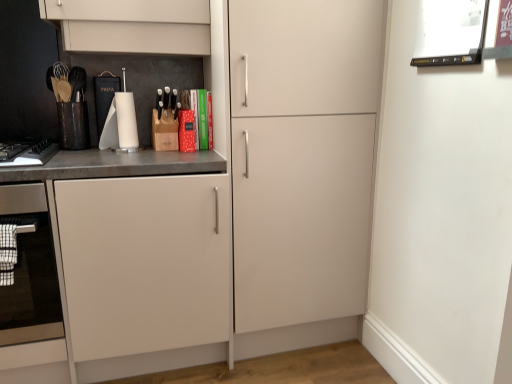
Locate an element on the screen. black matte keyboard at left is located at coordinates (33, 155).

What do you see at coordinates (56, 223) in the screenshot? I see `matte white cabinet at center` at bounding box center [56, 223].

How much space does white glossy picture frame at upper right, the 2th appliance when ordered from left to right, occupy vertically?

white glossy picture frame at upper right, the 2th appliance when ordered from left to right, is 9.01 inches tall.

Locate an element on the screen. Image resolution: width=512 pixels, height=384 pixels. stainless steel oven at left is located at coordinates (30, 270).

This screenshot has height=384, width=512. Find the location of `white glossy paper towel holder at center, the second appliance in the right-to-left sequence`. white glossy paper towel holder at center, the second appliance in the right-to-left sequence is located at coordinates (104, 96).

Considering the positions of objects matte white cabinet at center and stainless steel oven at left in the image provided, who is in front, matte white cabinet at center or stainless steel oven at left?

matte white cabinet at center is more forward.

Can we say matte white cabinet at center lies outside stainless steel oven at left?

That's correct, matte white cabinet at center is outside of stainless steel oven at left.

Is matte white cabinet at center to the right of stainless steel oven at left from the viewer's perspective?

Correct, you'll find matte white cabinet at center to the right of stainless steel oven at left.

Between black matte keyboard at left and matte white cabinet at center, which one has more height?

matte white cabinet at center.

In the scene shown: Is black matte keyboard at left oriented away from matte white cabinet at center?

No.

Does black matte keyboard at left appear on the right side of matte white cabinet at center?

Incorrect, black matte keyboard at left is not on the right side of matte white cabinet at center.

Relative to stainless steel oven at left, is white glossy paper towel holder at center, the first appliance from the back, in front or behind?

Clearly, white glossy paper towel holder at center, the first appliance from the back, is behind stainless steel oven at left.

Can we say white glossy paper towel holder at center, the second appliance in the right-to-left sequence, lies outside stainless steel oven at left?

Yes, white glossy paper towel holder at center, the second appliance in the right-to-left sequence, is outside of stainless steel oven at left.

Who is smaller, white glossy paper towel holder at center, the second appliance in the right-to-left sequence, or stainless steel oven at left?

Smaller between the two is white glossy paper towel holder at center, the second appliance in the right-to-left sequence.

From the picture: From the image's perspective, does white glossy paper towel holder at center, the second appliance in the right-to-left sequence, appear higher than stainless steel oven at left?

Yes, from the image's perspective, white glossy paper towel holder at center, the second appliance in the right-to-left sequence, is over stainless steel oven at left.

Considering the relative sizes of white glossy picture frame at upper right, placed as the first appliance when sorted from right to left, and black matte keyboard at left in the image provided, is white glossy picture frame at upper right, placed as the first appliance when sorted from right to left, bigger than black matte keyboard at left?

No.

Is white glossy picture frame at upper right, placed as the first appliance when sorted from right to left, completely or partially outside of black matte keyboard at left?

Yes, white glossy picture frame at upper right, placed as the first appliance when sorted from right to left, is not within black matte keyboard at left.

From a real-world perspective, is white glossy picture frame at upper right, positioned as the 2th appliance in back-to-front order, on top of black matte keyboard at left?

Correct, in the physical world, white glossy picture frame at upper right, positioned as the 2th appliance in back-to-front order, is higher than black matte keyboard at left.

Is white glossy picture frame at upper right, the 2th appliance when ordered from left to right, positioned with its back to black matte keyboard at left?

No, white glossy picture frame at upper right, the 2th appliance when ordered from left to right, is not facing the opposite direction of black matte keyboard at left.

Is stainless steel oven at left wider or thinner than white glossy picture frame at upper right, positioned as the 2th appliance in back-to-front order?

stainless steel oven at left is wider than white glossy picture frame at upper right, positioned as the 2th appliance in back-to-front order.

Is stainless steel oven at left smaller than white glossy picture frame at upper right, positioned as the 2th appliance in back-to-front order?

No.

From the image's perspective, is stainless steel oven at left on white glossy picture frame at upper right, which ranks as the 1th appliance in front-to-back order?

No, from the image's perspective, stainless steel oven at left is not above white glossy picture frame at upper right, which ranks as the 1th appliance in front-to-back order.

Considering the points (25, 261) and (438, 39), which point is in front, point (25, 261) or point (438, 39)?

Point (438, 39)

Is there a large distance between stainless steel oven at left and white glossy paper towel holder at center, which ranks as the first appliance in left-to-right order?

No, stainless steel oven at left is in close proximity to white glossy paper towel holder at center, which ranks as the first appliance in left-to-right order.

Is stainless steel oven at left positioned with its back to white glossy paper towel holder at center, the first appliance from the back?

No, stainless steel oven at left's orientation is not away from white glossy paper towel holder at center, the first appliance from the back.

Find the location of `oven on the left of white glossy paper towel holder at center, which appears as the second appliance when viewed from the front`. oven on the left of white glossy paper towel holder at center, which appears as the second appliance when viewed from the front is located at coordinates pos(30,270).

Can you confirm if stainless steel oven at left is wider than white glossy paper towel holder at center, which appears as the second appliance when viewed from the front?

Correct, the width of stainless steel oven at left exceeds that of white glossy paper towel holder at center, which appears as the second appliance when viewed from the front.

In the scene shown: Does matte white cabinet at center have a smaller size compared to black matte keyboard at left?

Actually, matte white cabinet at center might be larger than black matte keyboard at left.

Between matte white cabinet at center and black matte keyboard at left, which one appears on the right side from the viewer's perspective?

From the viewer's perspective, matte white cabinet at center appears more on the right side.

What's the angular difference between matte white cabinet at center and black matte keyboard at left's facing directions?

7.75e-05 degrees separate the facing orientations of matte white cabinet at center and black matte keyboard at left.

Is matte white cabinet at center beside black matte keyboard at left?

No.

Find the location of a particular element. cabinetry directly beneath the stainless steel oven at left (from a real-world perspective) is located at coordinates (56, 223).

Find the location of a particular element. home appliance above the matte white cabinet at center (from the image's perspective) is located at coordinates (33, 155).

In the scene shown: Based on their spatial positions, is stainless steel oven at left or matte white cabinet at center closer to black matte keyboard at left?

Among the two, matte white cabinet at center is located nearer to black matte keyboard at left.

Which object lies nearer to the anchor point matte white cabinet at center, black matte keyboard at left or white glossy paper towel holder at center, the first appliance from the back?

Among the two, black matte keyboard at left is located nearer to matte white cabinet at center.

Estimate the real-world distances between objects in this image. Which object is further from white glossy paper towel holder at center, which ranks as the first appliance in left-to-right order, black matte keyboard at left or stainless steel oven at left?

stainless steel oven at left is further to white glossy paper towel holder at center, which ranks as the first appliance in left-to-right order.

Which object lies nearer to the anchor point stainless steel oven at left, black matte keyboard at left or matte white cabinet at center?

Among the two, matte white cabinet at center is located nearer to stainless steel oven at left.

Based on their spatial positions, is matte white cabinet at center or stainless steel oven at left further from black matte keyboard at left?

stainless steel oven at left.

From the image, which object appears to be nearer to matte white cabinet at center, white glossy paper towel holder at center, which ranks as the first appliance in left-to-right order, or stainless steel oven at left?

Based on the image, stainless steel oven at left appears to be nearer to matte white cabinet at center.

Which object lies further to the anchor point black matte keyboard at left, white glossy paper towel holder at center, which ranks as the first appliance in left-to-right order, or stainless steel oven at left?

Based on the image, stainless steel oven at left appears to be further to black matte keyboard at left.

Looking at the image, which one is located further to stainless steel oven at left, white glossy picture frame at upper right, positioned as the 2th appliance in back-to-front order, or matte white cabinet at center?

white glossy picture frame at upper right, positioned as the 2th appliance in back-to-front order, is further to stainless steel oven at left.

The height and width of the screenshot is (384, 512). Identify the location of appliance between stainless steel oven at left and white glossy picture frame at upper right, which ranks as the 1th appliance in front-to-back order, in the horizontal direction. coord(104,96).

At what (x,y) coordinates should I click in order to perform the action: click on home appliance between white glossy paper towel holder at center, which ranks as the first appliance in left-to-right order, and stainless steel oven at left in the up-down direction. Please return your answer as a coordinate pair (x, y). Looking at the image, I should click on (33, 155).

Find the location of a particular element. oven between black matte keyboard at left and matte white cabinet at center from top to bottom is located at coordinates (30, 270).

Locate an element on the screen. The image size is (512, 384). appliance located between black matte keyboard at left and white glossy picture frame at upper right, positioned as the 2th appliance in back-to-front order, in the left-right direction is located at coordinates (104, 96).